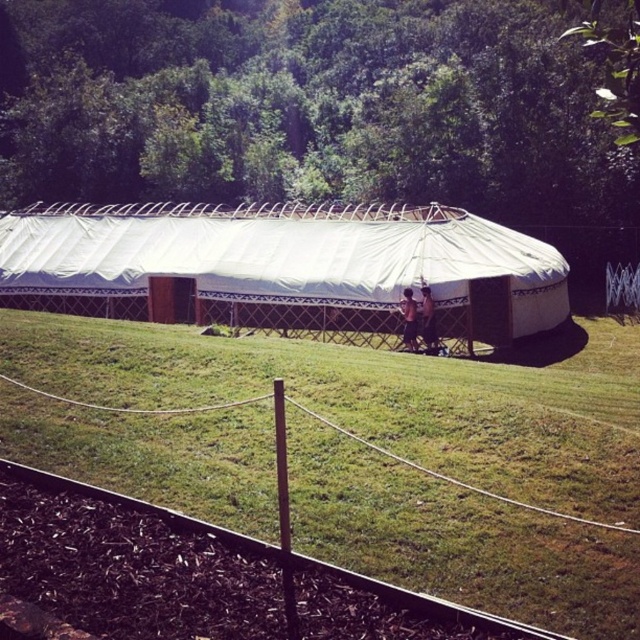
Does green grass at center have a lesser height compared to white canvas tent at center?

Correct, green grass at center is not as tall as white canvas tent at center.

Does green grass at center appear on the left side of white canvas tent at center?

No, green grass at center is not to the left of white canvas tent at center.

Is point (132, 458) closer to viewer compared to point (61, 260)?

Yes, it is.

Locate an element on the screen. green grass at center is located at coordinates (381, 397).

Is metallic wire fence at center thinner than light brown wooden chair at center?

In fact, metallic wire fence at center might be wider than light brown wooden chair at center.

Based on the photo, measure the distance from metallic wire fence at center to light brown wooden chair at center.

metallic wire fence at center is 10.87 meters away from light brown wooden chair at center.

The image size is (640, 640). What do you see at coordinates (621, 289) in the screenshot?
I see `metallic wire fence at center` at bounding box center [621, 289].

Locate an element on the screen. metallic wire fence at center is located at coordinates (621, 289).

Is green grass at center further to the viewer compared to metallic wire fence at center?

No, it is in front of metallic wire fence at center.

Is point (13, 340) positioned behind point (621, 288)?

No, it is in front of (621, 288).

This screenshot has width=640, height=640. I want to click on green grass at center, so click(381, 397).